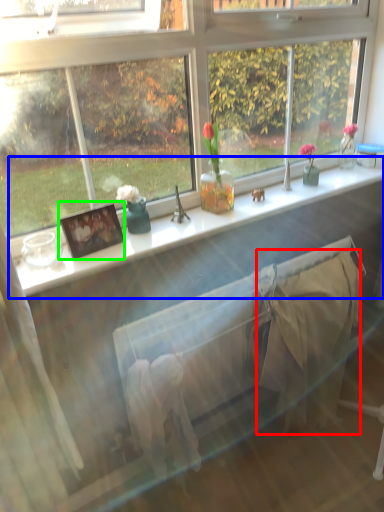
Question: Based on their relative distances, which object is farther from blanket (highlighted by a red box)? Choose from window sill (highlighted by a blue box) and picture frame (highlighted by a green box).

Choices:
 (A) window sill
 (B) picture frame

Answer: (B)